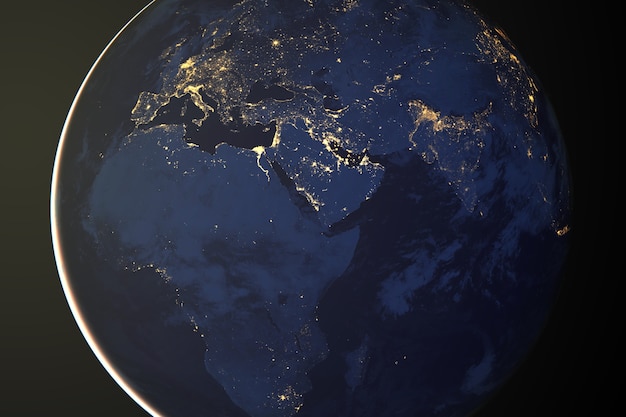
This screenshot has height=417, width=626. I want to click on light sources, so click(188, 89), click(182, 61), click(282, 132), click(257, 159), click(340, 140), click(319, 200), click(436, 115), click(509, 61), click(273, 396), click(151, 279).